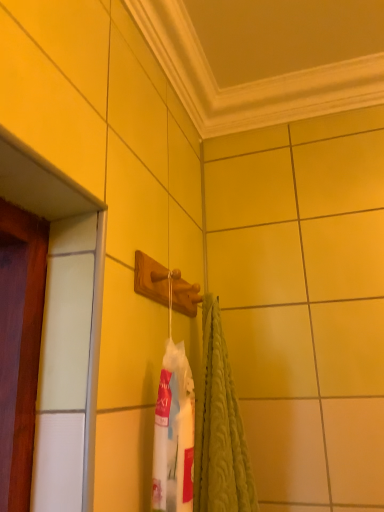
Describe the element at coordinates (151, 278) in the screenshot. I see `wooden at upper center` at that location.

Where is `wooden at upper center`? The height and width of the screenshot is (512, 384). wooden at upper center is located at coordinates (151, 278).

What are the coordinates of `wooden at upper center` in the screenshot? It's located at (151, 278).